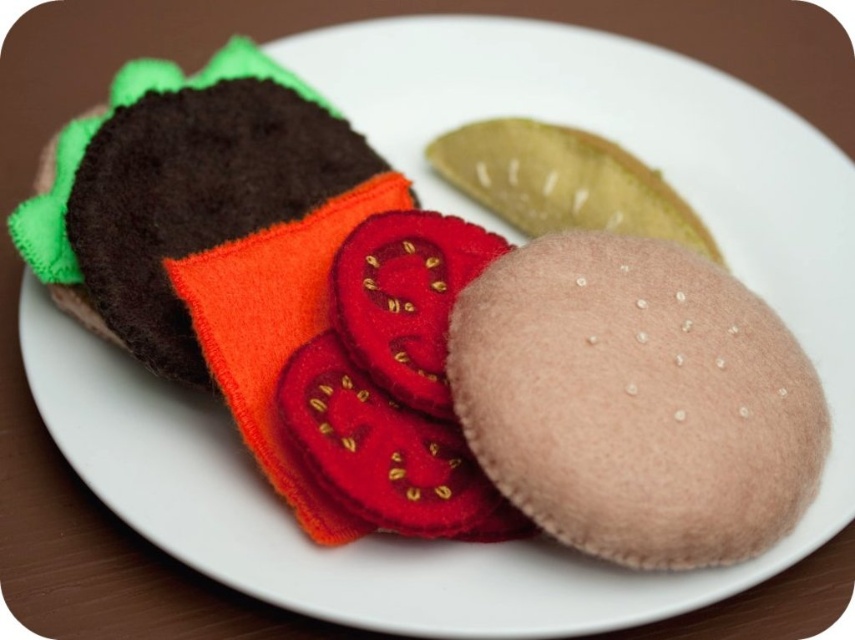
You are standing 3 feet away from the beige felt biscuit at center. Can you reach it without moving your feet?

The beige felt biscuit at center and camera are 3.37 feet apart, so you are 3 feet away from it. Since the distance is slightly less than 3.37 feet, you can reach it without moving your feet.

You are a food delivery robot that needs to place a beige felt biscuit at center and a smooth brown kiwi at center into a compartment that can only hold items up to 10 cm in width. The compartment is currently empty. Can both items fit side by side without overlapping?

The beige felt biscuit at center might be wider than smooth brown kiwi at center, but since the exact widths are not provided, we cannot determine if their combined width exceeds 10 cm. More information is needed.

You are a chef preparing a meal and need to place a beige felt biscuit exactly at the center of the plate. The plate has a coordinate system where the bottom left corner is the origin. The coordinates of the center are given as point (635, 401). Is there enough space to place the biscuit without overlapping the existing felt sandwich on the left and the pickle on the right?

At point (635, 401) lies beige felt biscuit at center. Therefore, the beige felt biscuit is already placed at the specified coordinates, so there is no need to move it. However, since the question mentions placing it there, it implies the biscuit is not yet present. Assuming the biscuit isn t there yet, we must check space. The Objects Description states the biscuit is at that point, so overlapping would occur if anything else is there. But according to the Scene description, the left has a sandwich and